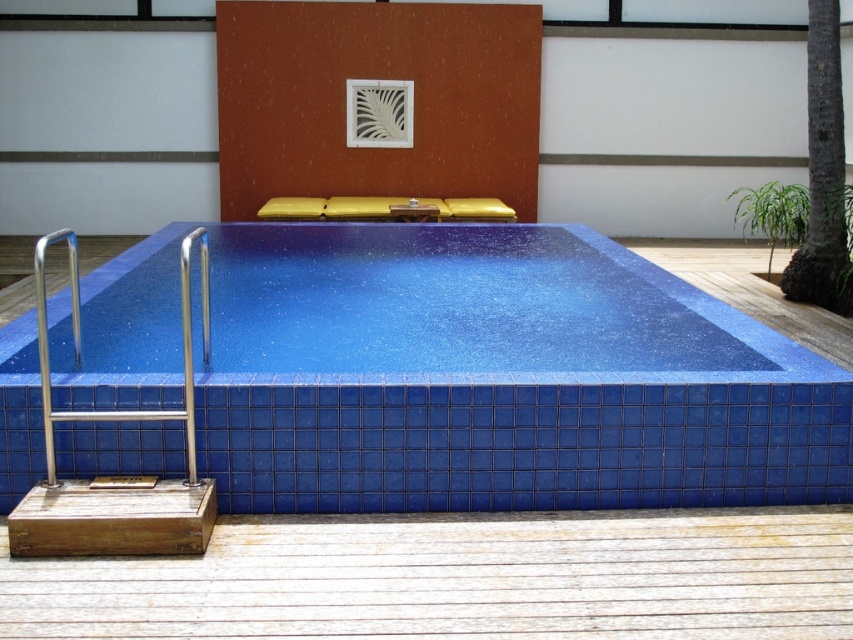
Question: Which point is closer to the camera taking this photo?

Choices:
 (A) (49, 477)
 (B) (184, 305)
 (C) (338, 252)
 (D) (782, 195)

Answer: (A)

Question: In this image, where is blue glossy tile swimming pool at lower left located relative to satin stainless steel handrail at lower left?

Choices:
 (A) left
 (B) right

Answer: (B)

Question: Which point is farther to the camera?

Choices:
 (A) pyautogui.click(x=207, y=234)
 (B) pyautogui.click(x=784, y=216)
 (C) pyautogui.click(x=38, y=269)
 (D) pyautogui.click(x=132, y=472)

Answer: (A)

Question: Which object appears farthest from the camera in this image?

Choices:
 (A) blue glossy tile swimming pool at lower left
 (B) satin stainless steel handrail at lower left
 (C) polished stainless steel handrail at lower left

Answer: (A)

Question: Is polished stainless steel handrail at lower left to the right of satin stainless steel handrail at lower left from the viewer's perspective?

Choices:
 (A) no
 (B) yes

Answer: (A)

Question: Can you confirm if polished stainless steel handrail at lower left is positioned to the left of satin stainless steel handrail at lower left?

Choices:
 (A) yes
 (B) no

Answer: (A)